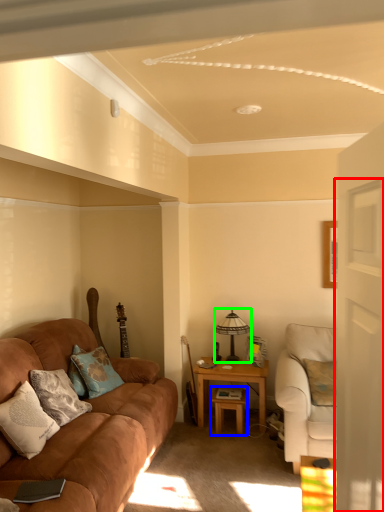
Question: Based on their relative distances, which object is farther from glass door (highlighted by a red box)? Choose from table (highlighted by a blue box) and table lamp (highlighted by a green box).

Choices:
 (A) table
 (B) table lamp

Answer: (B)